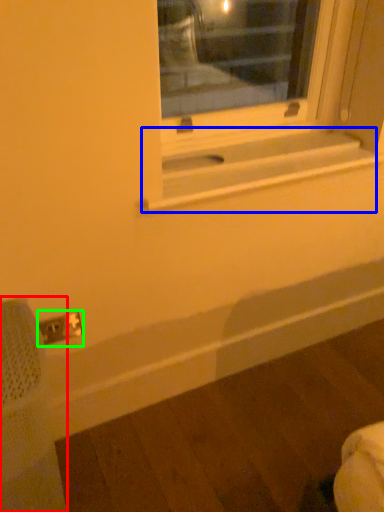
Question: Which object is positioned closest to swivel chair (highlighted by a red box)? Select from window sill (highlighted by a blue box) and electric outlet (highlighted by a green box).

Choices:
 (A) window sill
 (B) electric outlet

Answer: (B)